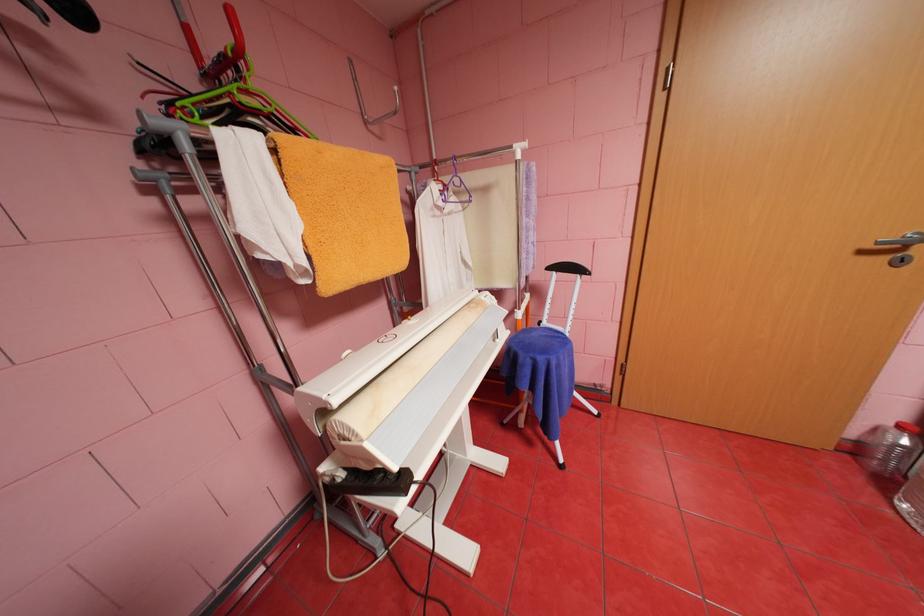
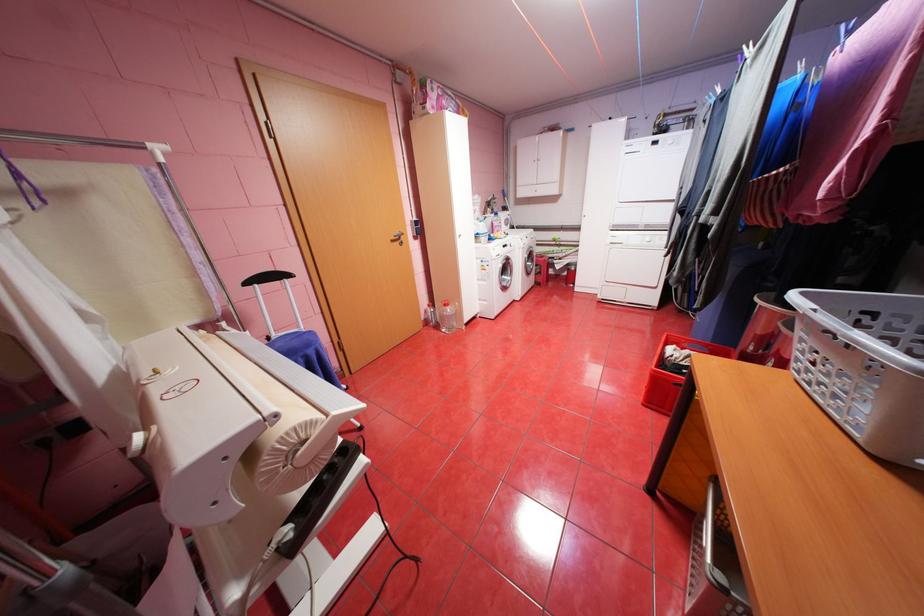
Where in the second image is the point corresponding to the point at 894,483 from the first image?

(445, 326)